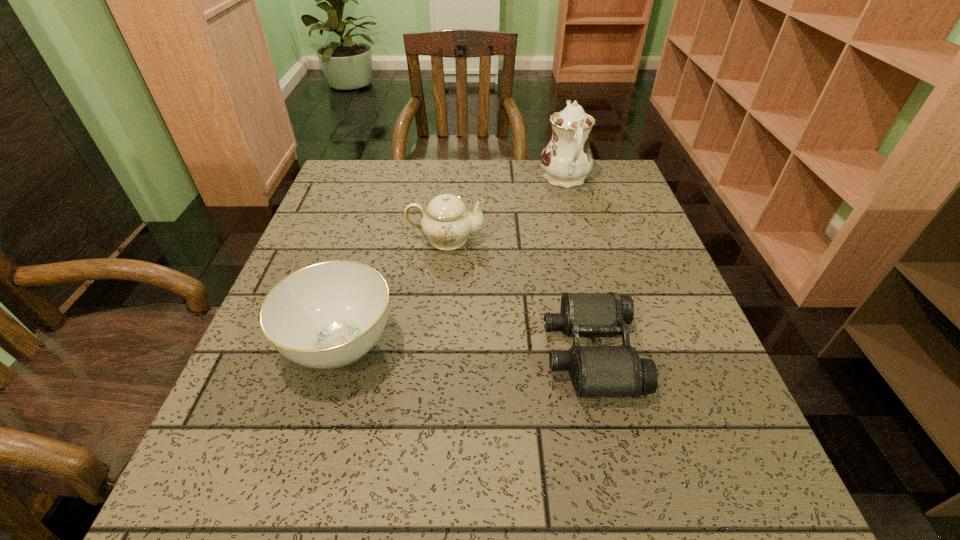
The height and width of the screenshot is (540, 960). Identify the location of vacant space situated 0.310m through the eyepieces of the shortest object. (376, 352).

Find the location of a particular element. The width and height of the screenshot is (960, 540). object that is at the far edge is located at coordinates (567, 159).

I want to click on object that is at the left edge, so click(328, 315).

The height and width of the screenshot is (540, 960). I want to click on chinaware that is at the right edge, so click(567, 159).

The height and width of the screenshot is (540, 960). I want to click on binoculars positioned at the right edge, so click(596, 371).

Where is `object that is at the far right corner`? The height and width of the screenshot is (540, 960). object that is at the far right corner is located at coordinates (567, 159).

In the image, there is a desktop. Find the location of `vacant space at the far edge`. vacant space at the far edge is located at coordinates (437, 175).

You are a GUI agent. You are given a task and a screenshot of the screen. Output one action in this format:
    pyautogui.click(x=<x>, y=<y>)
    Task: Click on the blank space at the near edge of the desktop
    
    Given the screenshot: What is the action you would take?
    pyautogui.click(x=318, y=516)

Identify the location of free space at the left edge. The width and height of the screenshot is (960, 540). (373, 220).

In the image, there is a desktop. What are the coordinates of `vacant space at the right edge` in the screenshot? It's located at (x=605, y=207).